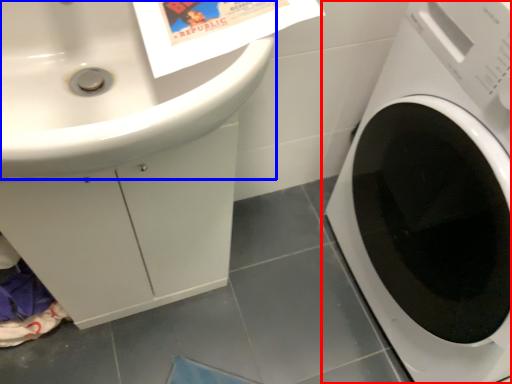
Question: Among these objects, which one is farthest to the camera, washing machine (highlighted by a red box) or sink (highlighted by a blue box)?

Choices:
 (A) washing machine
 (B) sink

Answer: (A)